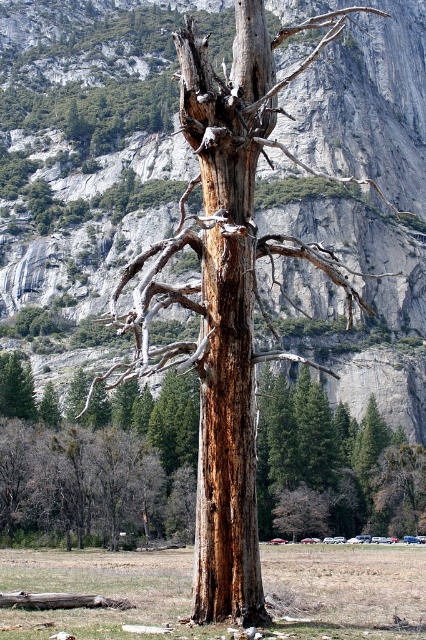
You are a hiker who has just arrived at the scene. You need to locate the rusty wood tree trunk at center. According to the coordinates provided, where should you look to find it?

The rusty wood tree trunk at center is located at point (103, 472).

You are a hiker trying to decide whether to climb the rugged stone mountain at center or walk through the brown grass at center. Based on their sizes, which option would require more physical effort?

The rugged stone mountain at center is bigger than the brown grass at center, so climbing the rugged stone mountain at center would require more physical effort.